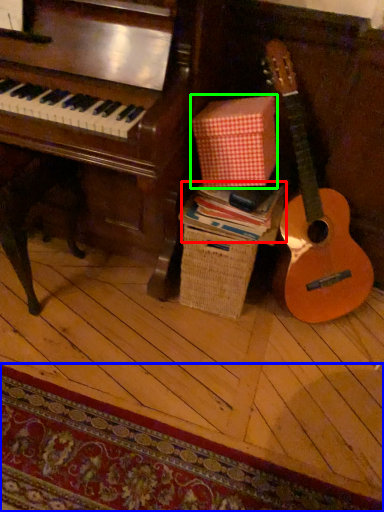
Question: Estimate the real-world distances between objects in this image. Which object is farther from book (highlighted by a red box), mat (highlighted by a blue box) or cardboard box (highlighted by a green box)?

Choices:
 (A) mat
 (B) cardboard box

Answer: (A)